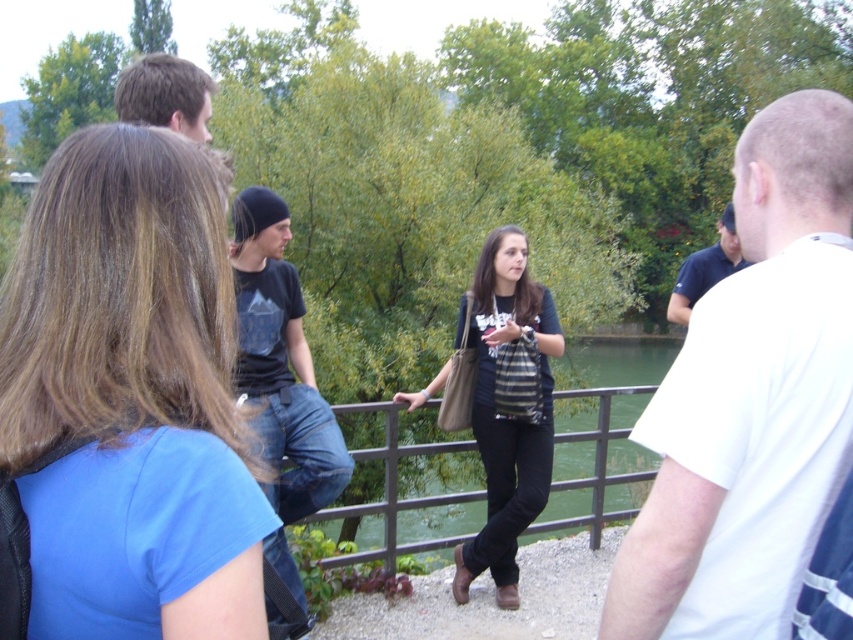
Is point (187, 205) positioned behind point (271, 456)?

No.

Is point (50, 486) behind point (250, 396)?

No, it is in front of (250, 396).

The image size is (853, 640). What are the coordinates of `blue fabric shirt at left` in the screenshot? It's located at (131, 396).

Can you confirm if dark brown hair at upper left is positioned above dark blue shirt at upper right?

Correct, dark brown hair at upper left is located above dark blue shirt at upper right.

Who is more forward, (175, 104) or (666, 310)?

Answer: Positioned in front is point (175, 104).

This screenshot has height=640, width=853. Find the location of `dark brown hair at upper left`. dark brown hair at upper left is located at coordinates (165, 93).

Locate an element on the screen. The height and width of the screenshot is (640, 853). dark brown hair at upper left is located at coordinates (165, 93).

Does metallic gray rail at center have a greater height compared to dark blue shirt at upper right?

Yes.

Between point (373, 412) and point (727, 241), which one is positioned in front?

Point (727, 241) is in front.

Where is `metallic gray rail at center`? The height and width of the screenshot is (640, 853). metallic gray rail at center is located at coordinates (393, 492).